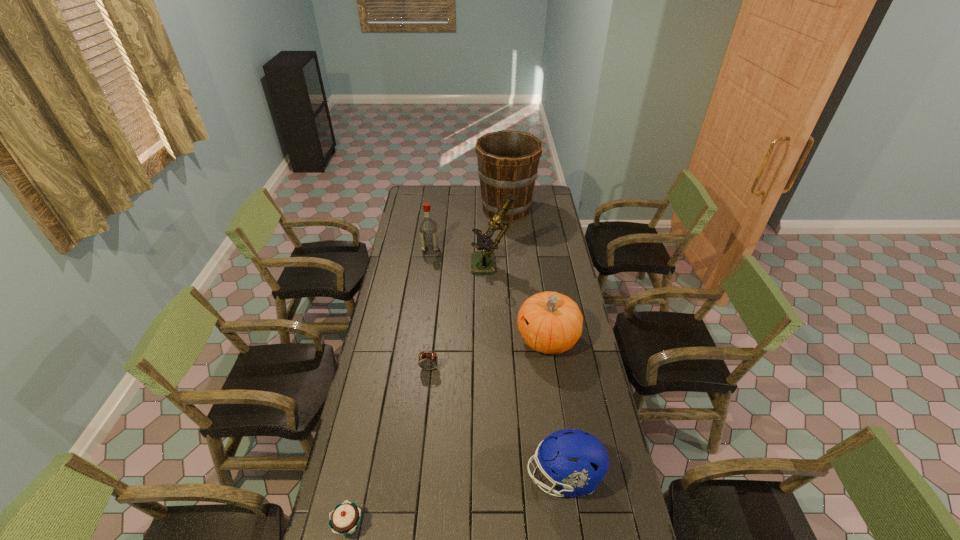
At what (x,y) coordinates should I click in order to perform the action: click on the farthest object. Please return your answer as a coordinate pair (x, y). Looking at the image, I should click on (508, 161).

The height and width of the screenshot is (540, 960). I want to click on microscope, so tap(483, 262).

You are a GUI agent. You are given a task and a screenshot of the screen. Output one action in this format:
    pyautogui.click(x=<x>, y=<y>)
    Task: Click on the liquor
    The width and height of the screenshot is (960, 540).
    Given the screenshot: What is the action you would take?
    pyautogui.click(x=428, y=229)

Locate an element on the screen. This screenshot has height=540, width=960. pumpkin is located at coordinates (551, 323).

Identify the location of the third shortest object. The height and width of the screenshot is (540, 960). (576, 460).

At what (x,y) coordinates should I click in order to perform the action: click on the second nearest object. Please return your answer as a coordinate pair (x, y). This screenshot has width=960, height=540. Looking at the image, I should click on (576, 460).

At what (x,y) coordinates should I click in order to perform the action: click on alarm clock. Please return your answer as a coordinate pair (x, y). The height and width of the screenshot is (540, 960). Looking at the image, I should click on (427, 361).

The height and width of the screenshot is (540, 960). Identify the location of vacant point located on the right of the bucket. (553, 210).

The image size is (960, 540). Find the location of `free location located 0.200m at the eyepiece of the microscope`. free location located 0.200m at the eyepiece of the microscope is located at coordinates 432,267.

This screenshot has height=540, width=960. What are the coordinates of `vacant space located at the eyepiece of the microscope` in the screenshot? It's located at (420, 267).